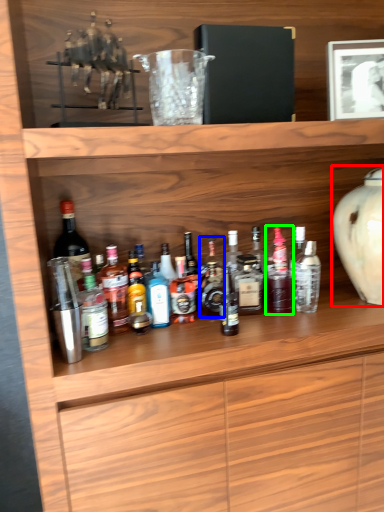
Question: Estimate the real-world distances between objects in this image. Which object is farther from vase (highlighted by a red box), bottle (highlighted by a blue box) or bottle (highlighted by a green box)?

Choices:
 (A) bottle
 (B) bottle

Answer: (A)